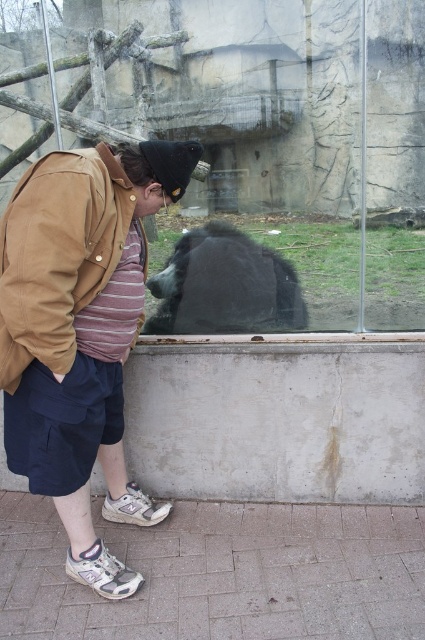
Question: Does brown cotton jacket at center appear under black fur bear at center?

Choices:
 (A) yes
 (B) no

Answer: (A)

Question: Is brown cotton jacket at center closer to the viewer compared to black fur bear at center?

Choices:
 (A) yes
 (B) no

Answer: (A)

Question: Among these points, which one is farthest from the camera?

Choices:
 (A) (252, 278)
 (B) (45, 173)

Answer: (A)

Question: Which object is closer to the camera taking this photo?

Choices:
 (A) black fur bear at center
 (B) brown cotton jacket at center

Answer: (B)

Question: Which point is closer to the camera?

Choices:
 (A) black fur bear at center
 (B) brown cotton jacket at center

Answer: (B)

Question: Can you confirm if brown cotton jacket at center is positioned to the right of black fur bear at center?

Choices:
 (A) no
 (B) yes

Answer: (A)